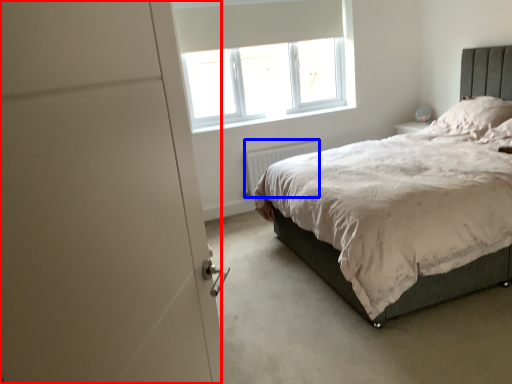
Question: Among these objects, which one is farthest to the camera, screen door (highlighted by a red box) or radiator (highlighted by a blue box)?

Choices:
 (A) screen door
 (B) radiator

Answer: (B)